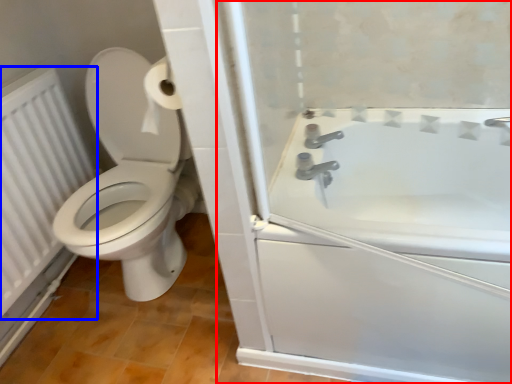
Question: Among these objects, which one is nearest to the camera, screen door (highlighted by a red box) or radiator (highlighted by a blue box)?

Choices:
 (A) screen door
 (B) radiator

Answer: (A)